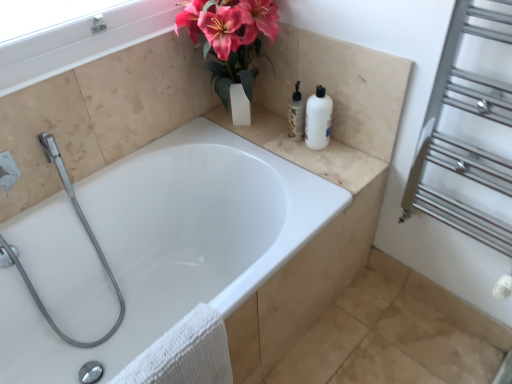
The image size is (512, 384). Identify the location of vacant region under silver metallic towel rack at right (from a real-world perspective). tap(418, 317).